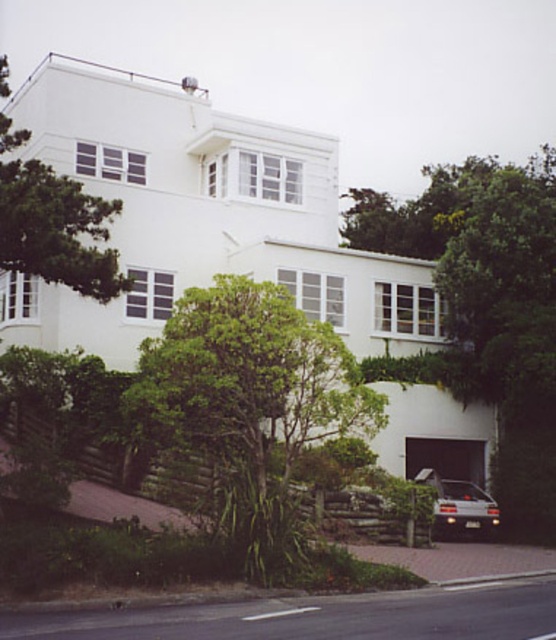
You are a delivery person trying to park your silver metallic car at lower right. The green leafy tree at center is blocking your path. Can you drive around it?

The green leafy tree at center is taller than silver metallic car at lower right, so you can drive around it since the tree is taller but not necessarily blocking the path physically. Check for clearance and space to maneuver around it.

You are a landscape architect planning to plant a new tree in the yard. The space available is only 2 meters wide. Given the green leafy tree at center and the silver metallic car at lower right, which object would you consider in terms of width to ensure the new tree fits?

The green leafy tree at center has a width less than the silver metallic car at lower right. Since the available space is 2 meters, you should compare the tree width to ensure it fits. If the tree is narrower than the car, but the car is already within the 2m limit, the tree would fit. However, if the car is wider than 2m, the tree might still fit if its width is under 2m. The description only states the tree is narrower than the car, so check the car width first.

You are a delivery person arriving at the house. You need to park the silver metallic car at lower right in a spot that won t block the driveway. The green leafy tree at center is in the way. Can you drive around it to park?

The green leafy tree at center is above the silver metallic car at lower right, meaning the tree is positioned higher up relative to the car. Since the tree is above the car, it doesn t block the driveway directly. You can drive around the tree to park the silver metallic car at lower right without blocking the driveway.